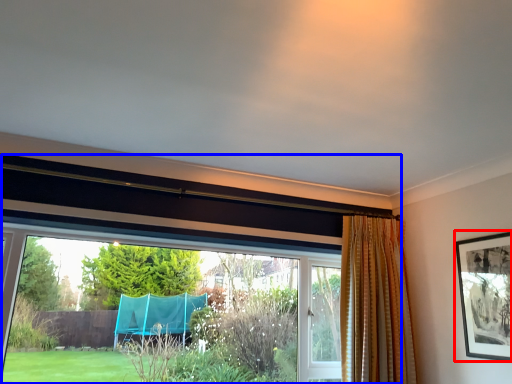
Question: Which object appears closest to the camera in this image, picture frame (highlighted by a red box) or window (highlighted by a blue box)?

Choices:
 (A) picture frame
 (B) window

Answer: (B)